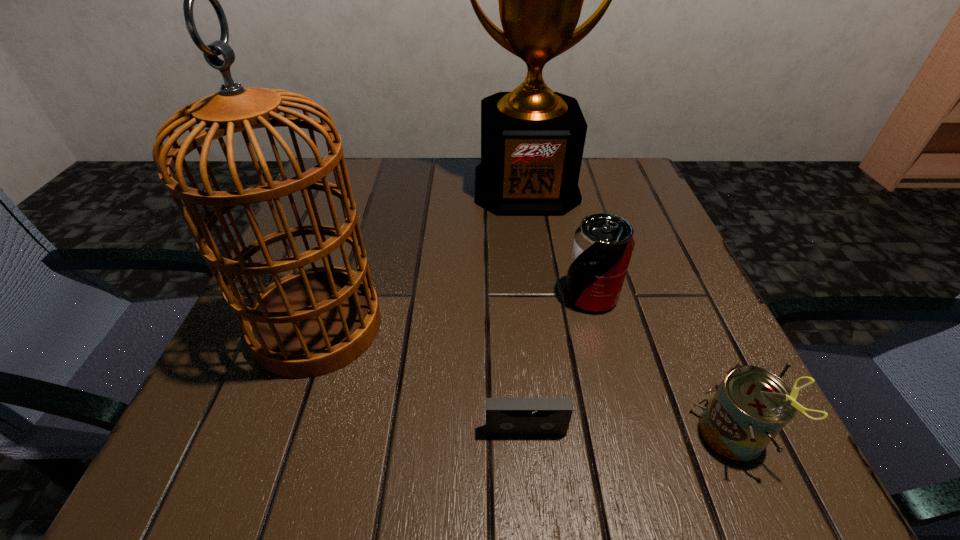
The height and width of the screenshot is (540, 960). What are the coordinates of `free space in the image that satisfies the following two spatial constraints: 1. on the front-facing side of the shortest object; 2. on the right side of the can` in the screenshot? It's located at (526, 435).

This screenshot has height=540, width=960. Find the location of `free point that satisfies the following two spatial constraints: 1. on the front of the farthest object with the label; 2. on the right side of the soda can`. free point that satisfies the following two spatial constraints: 1. on the front of the farthest object with the label; 2. on the right side of the soda can is located at coordinates (541, 295).

This screenshot has height=540, width=960. I want to click on vacant region that satisfies the following two spatial constraints: 1. on the front of the trophy cup with the label; 2. on the left side of the can, so click(x=562, y=435).

Identify the location of vacant space that satisfies the following two spatial constraints: 1. on the front of the trophy cup with the label; 2. on the right side of the can. (562, 435).